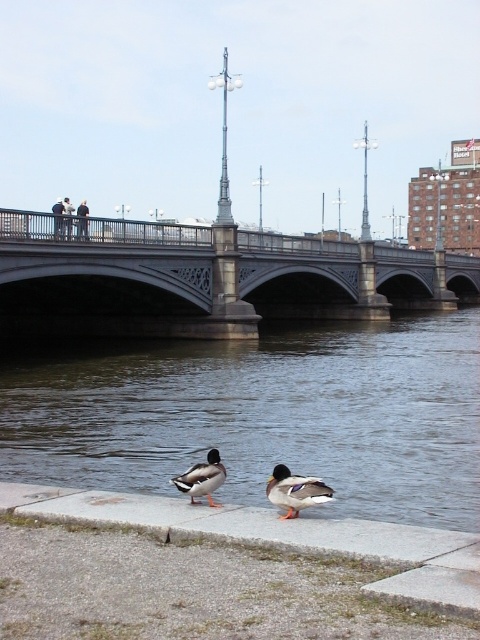
You are a photographer planning to take a wide shot of the riverside scene. You need to include both the stone bridge at center and the dark blue jeans at upper center in your frame. Based on their sizes, which object should you prioritize positioning closer to the camera to ensure both fit in the photo?

The stone bridge at center might be wider than dark blue jeans at upper center, so to ensure both fit in the photo, prioritize positioning the stone bridge at center closer to the camera since it is likely wider and requires more space in the frame.

You are a photographer planning to capture the stone bridge at center in the background of your photo. You notice a point at coordinates point (211, 276). Can you confirm if this point is where the stone bridge at center is located?

Yes, the point (211, 276) corresponds to the location of the stone bridge at center, so you can use this coordinate to frame your shot.

You are a delivery drone that needs to fly between the stone bridge at center and the gray concrete ledge at lower center. Which structure has a wider pathway for you to navigate through?

The stone bridge at center has a wider pathway than the gray concrete ledge at lower center since its width is larger.